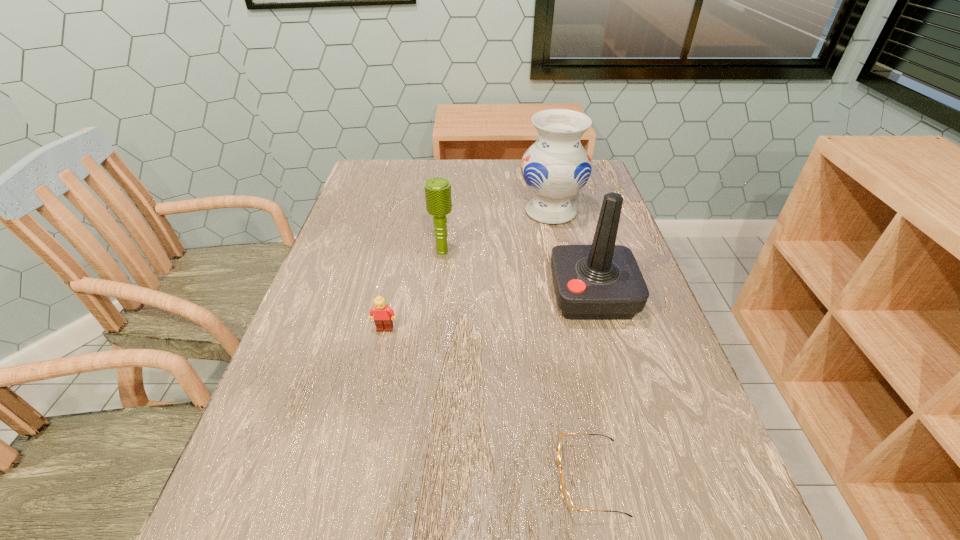
Locate an element on the screen. Image resolution: width=960 pixels, height=540 pixels. free space located on the left of the microphone is located at coordinates (328, 252).

Find the location of a particular element. The height and width of the screenshot is (540, 960). blank space located on the face of the fourth tallest object is located at coordinates (379, 356).

Where is `vacant space located 0.390m on the front-facing side of the shortest object`? The image size is (960, 540). vacant space located 0.390m on the front-facing side of the shortest object is located at coordinates (308, 477).

Locate an element on the screen. free space located 0.390m on the front-facing side of the shortest object is located at coordinates (308, 477).

Where is `free region located on the front-facing side of the shortest object`? free region located on the front-facing side of the shortest object is located at coordinates (359, 477).

Locate an element on the screen. This screenshot has height=540, width=960. object at the far edge is located at coordinates (556, 167).

At what (x,y) coordinates should I click in order to perform the action: click on object positioned at the left edge. Please return your answer as a coordinate pair (x, y). The image size is (960, 540). Looking at the image, I should click on (383, 316).

This screenshot has width=960, height=540. Identify the location of vase that is at the right edge. (556, 167).

This screenshot has width=960, height=540. In order to click on joystick that is at the right edge in this screenshot , I will do `click(602, 281)`.

Locate an element on the screen. The image size is (960, 540). spectacles present at the right edge is located at coordinates (566, 496).